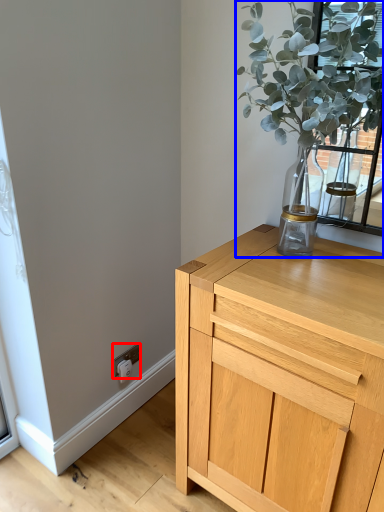
Question: Which object is closer to the camera taking this photo, electric outlet (highlighted by a red box) or houseplant (highlighted by a blue box)?

Choices:
 (A) electric outlet
 (B) houseplant

Answer: (B)